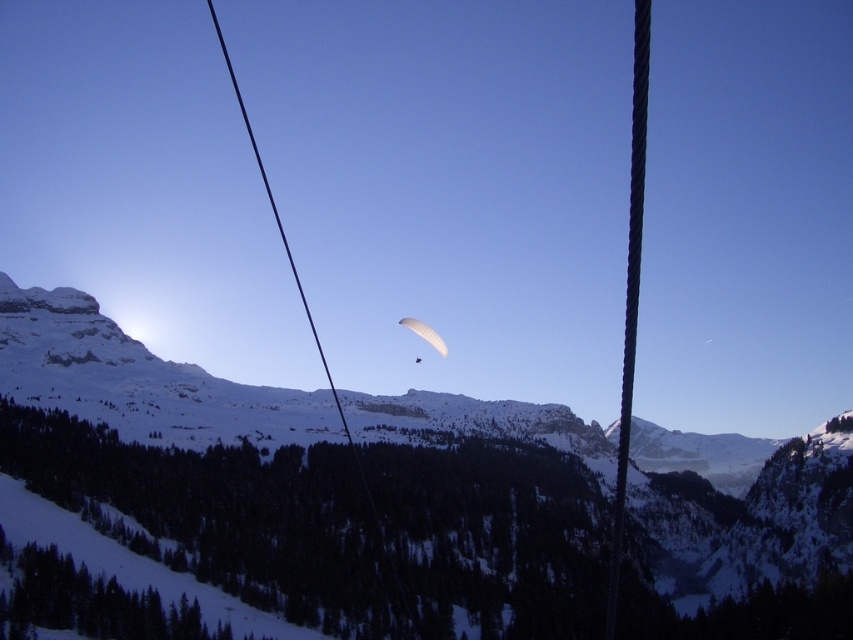
Question: Which object is farther from the camera taking this photo?

Choices:
 (A) white matte parachute at center
 (B) black rope at right

Answer: (A)

Question: Does snowy rocky mountain at center have a larger size compared to black wire at center?

Choices:
 (A) no
 (B) yes

Answer: (A)

Question: Considering the relative positions of black rope at right and white matte parachute at center in the image provided, where is black rope at right located with respect to white matte parachute at center?

Choices:
 (A) left
 (B) right

Answer: (B)

Question: Does snowy rocky mountain at center appear over black wire at center?

Choices:
 (A) no
 (B) yes

Answer: (A)

Question: Which point is closer to the camera taking this photo?

Choices:
 (A) (633, 112)
 (B) (350, 442)
 (C) (440, 353)

Answer: (B)

Question: Which object is farther from the camera taking this photo?

Choices:
 (A) black wire at center
 (B) snowy rocky mountain at center
 (C) white matte parachute at center
 (D) black rope at right

Answer: (C)